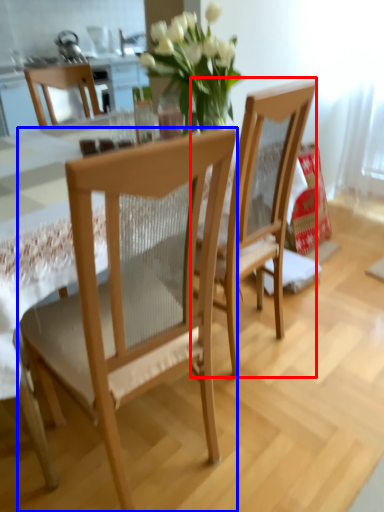
Question: Which object is closer to the camera taking this photo, chair (highlighted by a red box) or chair (highlighted by a blue box)?

Choices:
 (A) chair
 (B) chair

Answer: (B)